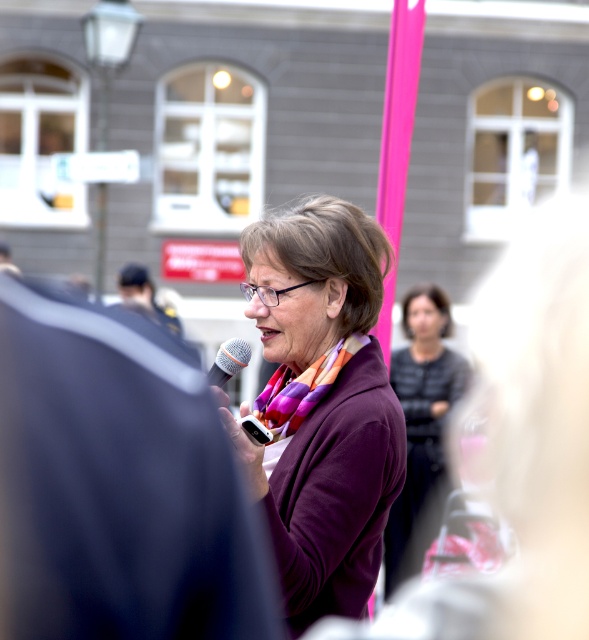
From the picture: You are a photographer trying to capture a closeup of the purple soft sweater at center. Based on its position in the image, what coordinates should you focus on?

The photographer should focus on the coordinates point [322,404] to capture the purple soft sweater at center.

You are standing at the event and want to know which of the two points, point (326, 518) or point (267, 424), is nearer to you. Based on the scene, which point is closer?

Point (326, 518) is closer to the viewer than point (267, 424).